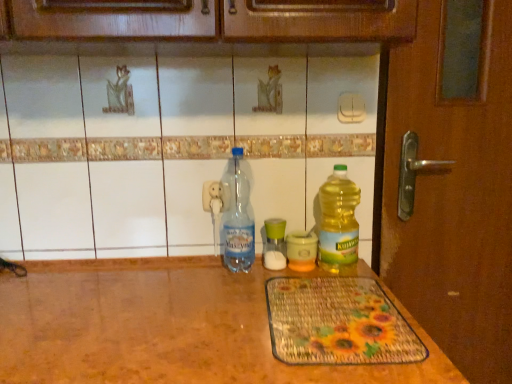
Question: Is green glass jar at center, arranged as the 2th bottle when viewed from the left, bigger than translucent plastic bottle at right, which appears as the fourth bottle when viewed from the left?

Choices:
 (A) no
 (B) yes

Answer: (A)

Question: From a real-world perspective, does green glass jar at center, which is the 3th bottle from right to left, sit lower than translucent plastic bottle at right, which appears as the fourth bottle when viewed from the left?

Choices:
 (A) no
 (B) yes

Answer: (B)

Question: Is green glass jar at center, arranged as the 2th bottle when viewed from the left, closer to camera compared to translucent plastic bottle at right, which appears as the fourth bottle when viewed from the left?

Choices:
 (A) no
 (B) yes

Answer: (A)

Question: Does green glass jar at center, arranged as the 2th bottle when viewed from the left, have a lesser width compared to translucent plastic bottle at right, marked as the first bottle in a right-to-left arrangement?

Choices:
 (A) yes
 (B) no

Answer: (A)

Question: From the image's perspective, is green glass jar at center, arranged as the 2th bottle when viewed from the left, located above translucent plastic bottle at right, marked as the first bottle in a right-to-left arrangement?

Choices:
 (A) yes
 (B) no

Answer: (B)

Question: From the image's perspective, is green glass jar at center, which is the 3th bottle from right to left, beneath translucent plastic bottle at right, marked as the first bottle in a right-to-left arrangement?

Choices:
 (A) no
 (B) yes

Answer: (B)

Question: Considering the relative sizes of yellow translucent bottle at center, the second bottle positioned from the right, and green glass jar at center, arranged as the 2th bottle when viewed from the left, in the image provided, is yellow translucent bottle at center, the second bottle positioned from the right, wider than green glass jar at center, arranged as the 2th bottle when viewed from the left,?

Choices:
 (A) yes
 (B) no

Answer: (A)

Question: From a real-world perspective, is yellow translucent bottle at center, the second bottle positioned from the right, positioned over green glass jar at center, arranged as the 2th bottle when viewed from the left, based on gravity?

Choices:
 (A) yes
 (B) no

Answer: (B)

Question: Considering the relative sizes of yellow translucent bottle at center, which ranks as the 3th bottle in left-to-right order, and green glass jar at center, arranged as the 2th bottle when viewed from the left, in the image provided, is yellow translucent bottle at center, which ranks as the 3th bottle in left-to-right order, taller than green glass jar at center, arranged as the 2th bottle when viewed from the left,?

Choices:
 (A) yes
 (B) no

Answer: (A)

Question: Is yellow translucent bottle at center, which ranks as the 3th bottle in left-to-right order, bigger than green glass jar at center, which is the 3th bottle from right to left?

Choices:
 (A) yes
 (B) no

Answer: (A)

Question: From the image's perspective, is yellow translucent bottle at center, which ranks as the 3th bottle in left-to-right order, beneath green glass jar at center, which is the 3th bottle from right to left?

Choices:
 (A) no
 (B) yes

Answer: (B)

Question: From the image's perspective, does yellow translucent bottle at center, the second bottle positioned from the right, appear higher than green glass jar at center, which is the 3th bottle from right to left?

Choices:
 (A) yes
 (B) no

Answer: (B)

Question: Considering the relative sizes of translucent plastic bottle at right, marked as the first bottle in a right-to-left arrangement, and yellow translucent bottle at center, the second bottle positioned from the right, in the image provided, is translucent plastic bottle at right, marked as the first bottle in a right-to-left arrangement, wider than yellow translucent bottle at center, the second bottle positioned from the right,?

Choices:
 (A) yes
 (B) no

Answer: (B)